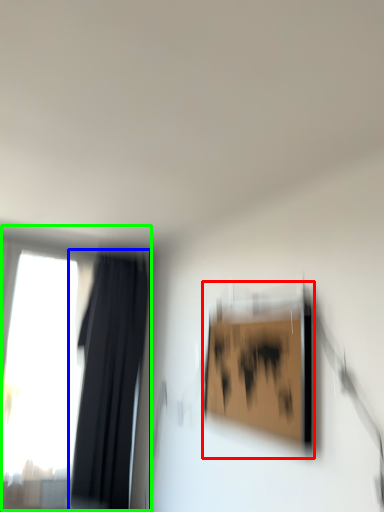
Question: Estimate the real-world distances between objects in this image. Which object is closer to picture frame (highlighted by a red box), curtain (highlighted by a blue box) or window (highlighted by a green box)?

Choices:
 (A) curtain
 (B) window

Answer: (A)